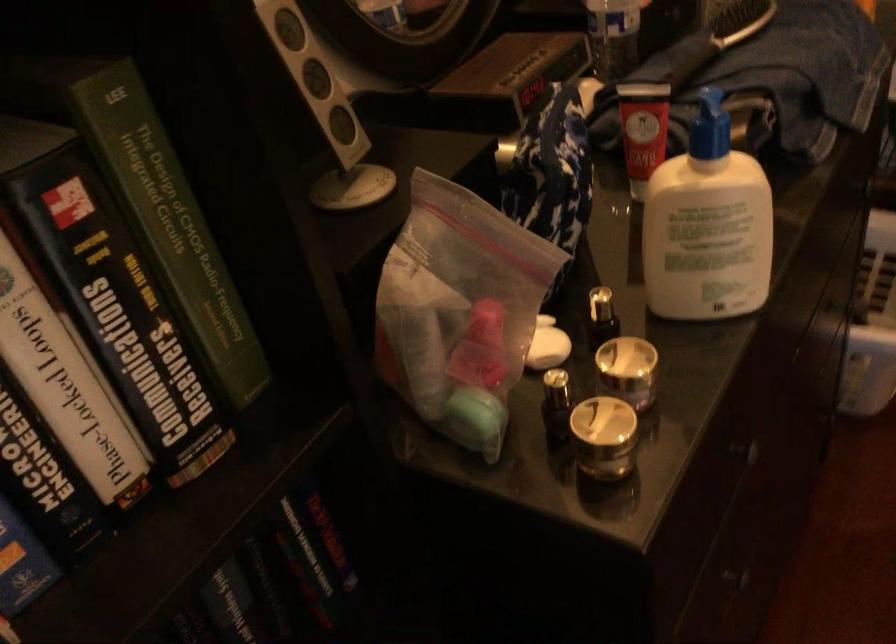
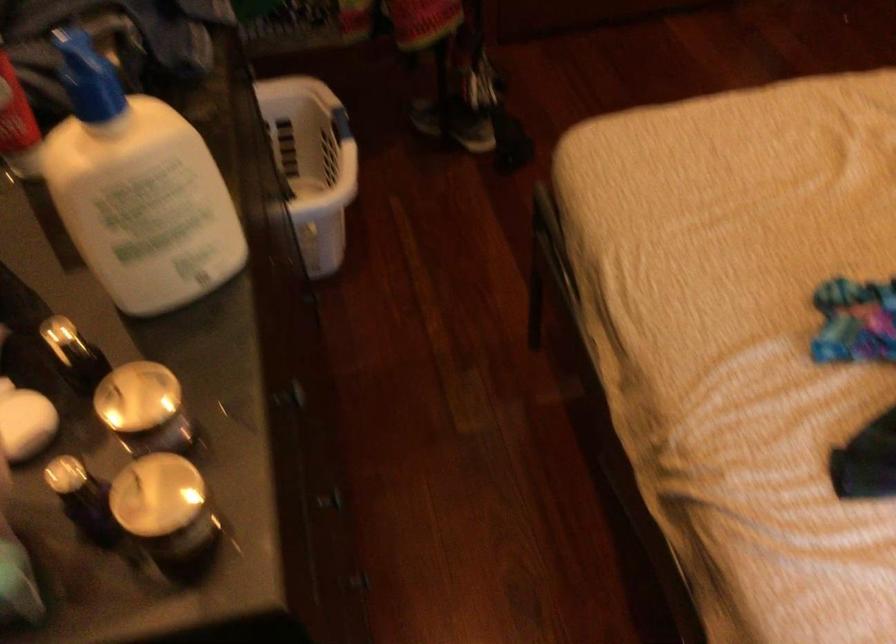
Where in the second image is the point corresponding to (x=733, y=574) from the first image?

(330, 500)